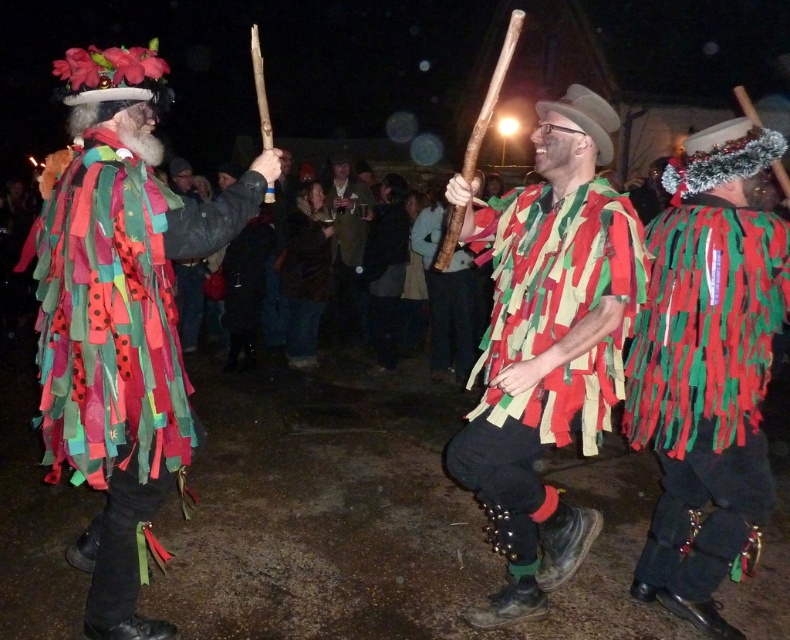
You are a photographer standing in the scene wanting to capture a photo of both the multicolored fabric costume at left and the matte green and red fabric at center without moving your camera position. Can you fit both objects in the frame if your camera has a field of view that can capture 1.2 meters width?

The multicolored fabric costume at left and the matte green and red fabric at center are 1.06 meters apart from each other. Since the camera can capture 1.2 meters width, both objects can fit in the frame as the distance between them is less than the camera field of view.

You are organizing a parade and need to determine the order of the participants based on their costume sizes. Given the multicolored fabric costume at left and the velvet brown vest at center, which costume should come first if larger costumes lead the parade?

The multicolored fabric costume at left is larger in size than the velvet brown vest at center, so it should come first in the parade order.